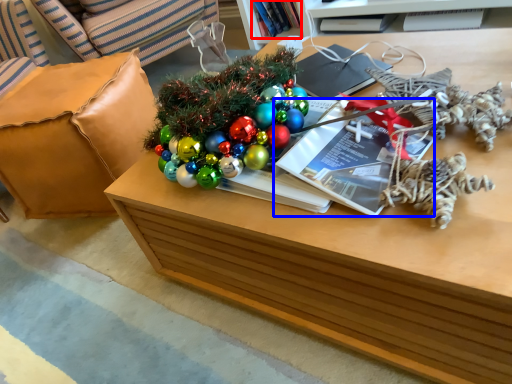
Question: Which object appears farthest to the camera in this image, book (highlighted by a red box) or magazine (highlighted by a blue box)?

Choices:
 (A) book
 (B) magazine

Answer: (A)